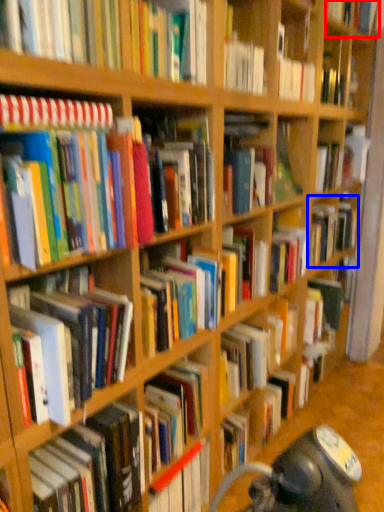
Question: Which point is closer to the camera, book (highlighted by a red box) or book (highlighted by a blue box)?

Choices:
 (A) book
 (B) book

Answer: (A)